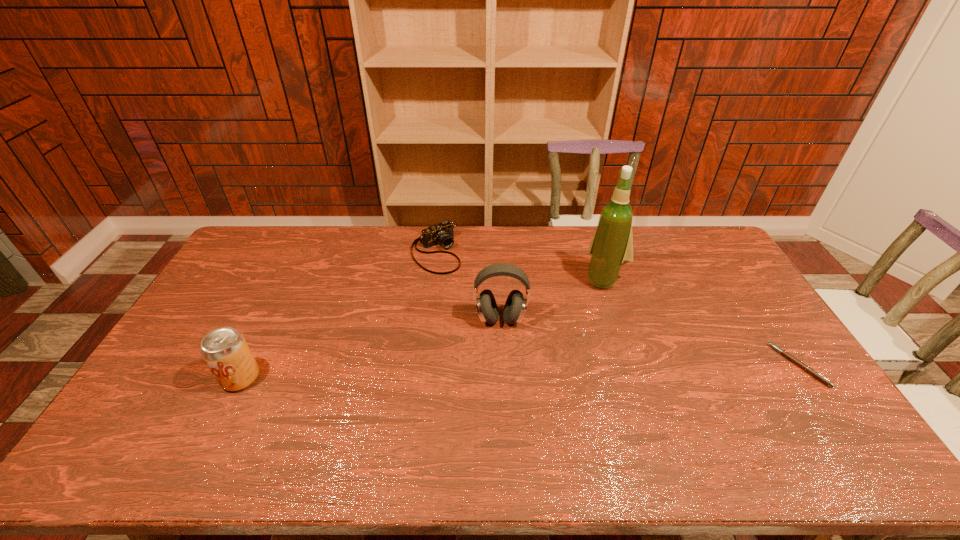
Find the location of a particular element. vacant area between the headset and the rightmost object is located at coordinates (650, 342).

Identify the location of free space between the second object from right to left and the leftmost object. (422, 328).

Locate an element on the screen. empty location between the pop (soda) and the second tallest object is located at coordinates (371, 348).

Where is `free spot between the fourth object from right to left and the fourth object from left to right`? Image resolution: width=960 pixels, height=540 pixels. free spot between the fourth object from right to left and the fourth object from left to right is located at coordinates (520, 265).

The height and width of the screenshot is (540, 960). I want to click on empty space that is in between the shortest object and the leftmost object, so click(x=519, y=372).

Locate an element on the screen. The width and height of the screenshot is (960, 540). free area in between the tallest object and the shortest object is located at coordinates 702,322.

At what (x,y) coordinates should I click in order to perform the action: click on free area in between the pop (soda) and the wine bottle. Please return your answer as a coordinate pair (x, y). Looking at the image, I should click on (422, 328).

Locate an element on the screen. vacant region between the fourth object from left to right and the headset is located at coordinates (553, 299).

This screenshot has height=540, width=960. Identify the location of unoccupied position between the third object from left to right and the shortest object. pos(650,342).

The width and height of the screenshot is (960, 540). Find the location of `vacant space that's between the third nearest object and the third shortest object`. vacant space that's between the third nearest object and the third shortest object is located at coordinates (371, 348).